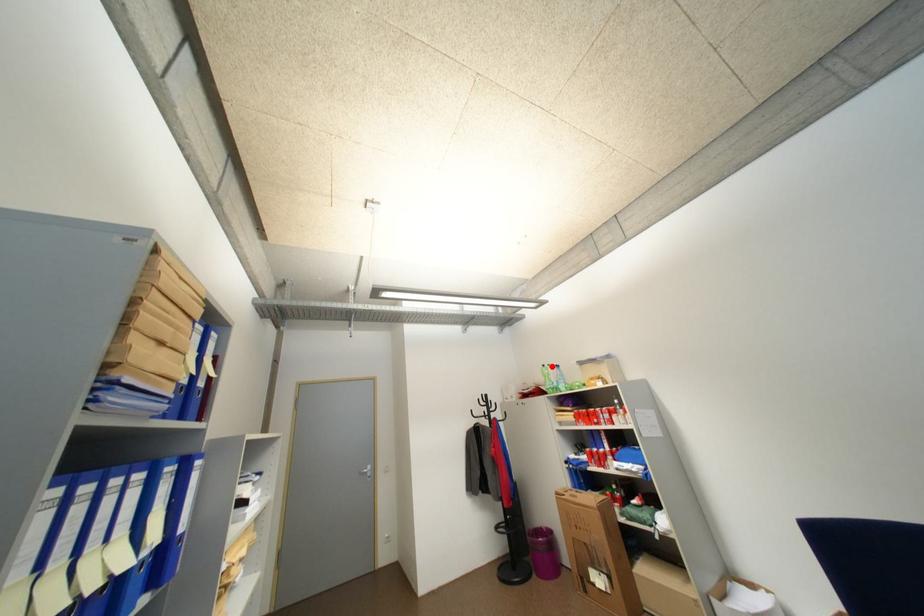
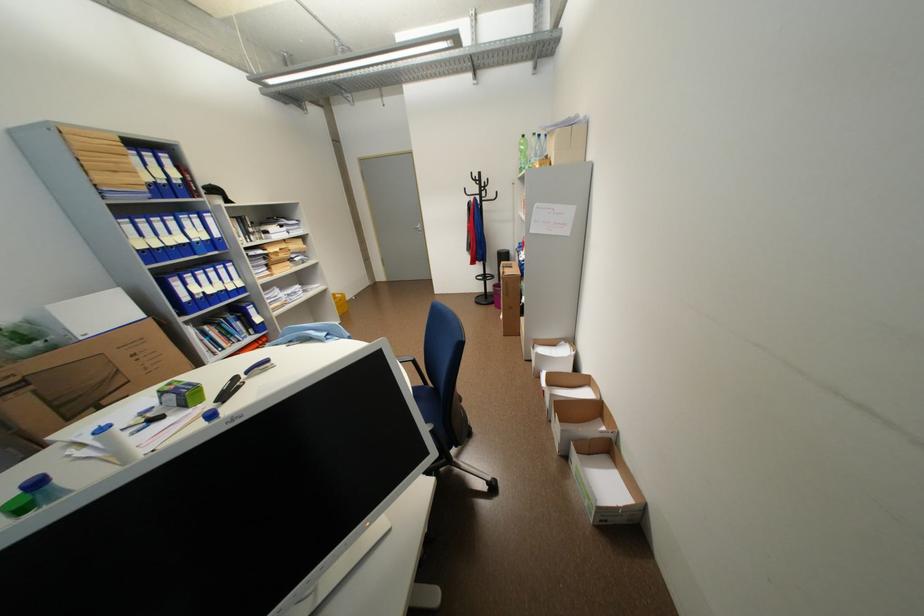
Question: I am providing you with two images of the same scene from different viewpoints. Given a red point in image1, look at the same physical point in image2. Is it:

Choices:
 (A) Closer to the viewpoint
 (B) Farther from the viewpoint

Answer: (A)